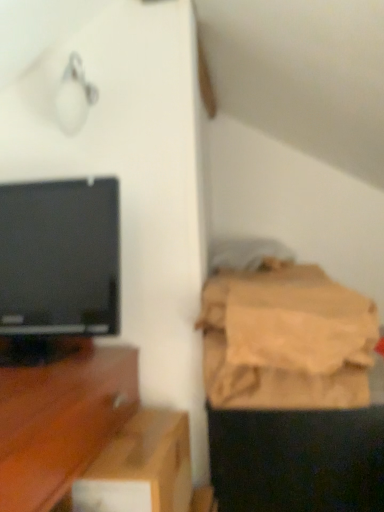
Question: Considering the relative positions of black glossy television at left and brown cardboard box at lower center in the image provided, is black glossy television at left to the left or to the right of brown cardboard box at lower center?

Choices:
 (A) right
 (B) left

Answer: (B)

Question: In terms of height, does black glossy television at left look taller or shorter compared to brown cardboard box at lower center?

Choices:
 (A) short
 (B) tall

Answer: (B)

Question: Which is nearer to the black glossy television at left?

Choices:
 (A) brown fabric bag at right
 (B) wooden tv stand at left
 (C) brown cardboard box at lower center

Answer: (B)

Question: Which object is positioned farthest from the brown fabric bag at right?

Choices:
 (A) brown cardboard box at lower center
 (B) black glossy television at left
 (C) wooden tv stand at left

Answer: (B)